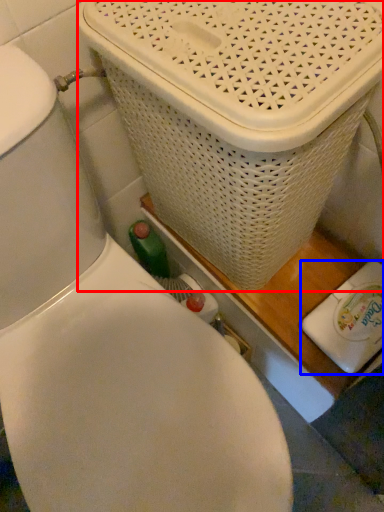
Question: Which object is further to the camera taking this photo, basket container (highlighted by a red box) or appliance (highlighted by a blue box)?

Choices:
 (A) basket container
 (B) appliance

Answer: (B)